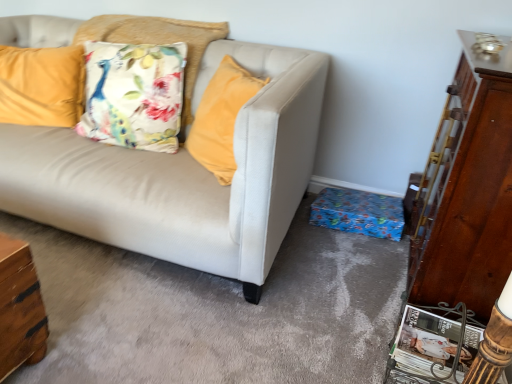
Question: Does wooden dresser at right touch floral fabric pillow at upper left, which is the 2th pillow from left to right?

Choices:
 (A) no
 (B) yes

Answer: (A)

Question: Is floral fabric pillow at upper left, the first pillow viewed from the right, completely or partially inside wooden dresser at right?

Choices:
 (A) no
 (B) yes

Answer: (A)

Question: Considering the relative sizes of wooden dresser at right and floral fabric pillow at upper left, which is the 2th pillow from left to right, in the image provided, is wooden dresser at right shorter than floral fabric pillow at upper left, which is the 2th pillow from left to right,?

Choices:
 (A) yes
 (B) no

Answer: (B)

Question: From a real-world perspective, is wooden dresser at right located higher than floral fabric pillow at upper left, which is the 2th pillow from left to right?

Choices:
 (A) no
 (B) yes

Answer: (A)

Question: From a real-world perspective, is wooden dresser at right beneath floral fabric pillow at upper left, the first pillow viewed from the right?

Choices:
 (A) yes
 (B) no

Answer: (A)

Question: Is wooden dresser at right facing away from floral fabric pillow at upper left, which is the 2th pillow from left to right?

Choices:
 (A) no
 (B) yes

Answer: (A)

Question: Does floral fabric pillow at upper left, which is the 2th pillow from left to right, have a lesser width compared to velvet yellow pillow at upper left, the 1th pillow from the left?

Choices:
 (A) yes
 (B) no

Answer: (B)

Question: From a real-world perspective, is floral fabric pillow at upper left, which is the 2th pillow from left to right, positioned over velvet yellow pillow at upper left, the 1th pillow from the left, based on gravity?

Choices:
 (A) no
 (B) yes

Answer: (B)

Question: Is floral fabric pillow at upper left, the first pillow viewed from the right, located outside velvet yellow pillow at upper left, the 1th pillow from the left?

Choices:
 (A) no
 (B) yes

Answer: (B)

Question: Is floral fabric pillow at upper left, the first pillow viewed from the right, to the right of velvet yellow pillow at upper left, the 1th pillow from the left, from the viewer's perspective?

Choices:
 (A) no
 (B) yes

Answer: (B)

Question: Considering the relative positions of floral fabric pillow at upper left, which is the 2th pillow from left to right, and velvet yellow pillow at upper left, the 2th pillow in the right-to-left sequence, in the image provided, is floral fabric pillow at upper left, which is the 2th pillow from left to right, in front of velvet yellow pillow at upper left, the 2th pillow in the right-to-left sequence,?

Choices:
 (A) no
 (B) yes

Answer: (B)

Question: Is floral fabric pillow at upper left, which is the 2th pillow from left to right, beside velvet yellow pillow at upper left, the 2th pillow in the right-to-left sequence?

Choices:
 (A) yes
 (B) no

Answer: (B)

Question: Is velvet yellow pillow at upper left, the 2th pillow in the right-to-left sequence, bigger than wooden dresser at right?

Choices:
 (A) yes
 (B) no

Answer: (B)